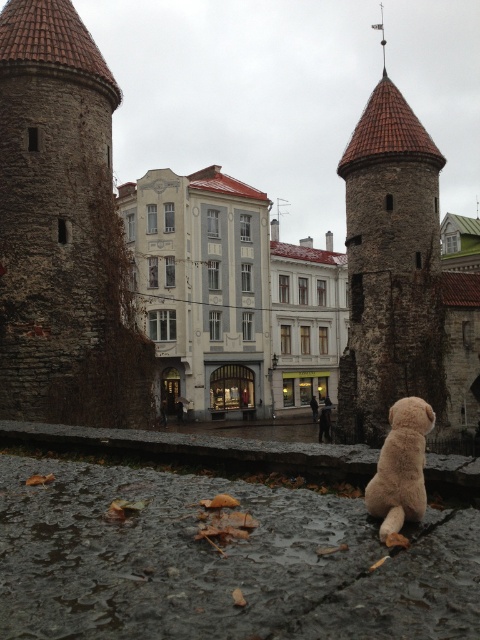
You are a tourist in the historic town and notice the rusty metal tower at center and the fuzzy beige stuffed animal at lower right. Which object is closer to the camera from your viewpoint?

The rusty metal tower at center is positioned over the fuzzy beige stuffed animal at lower right, meaning the tower is closer to the camera than the stuffed animal.